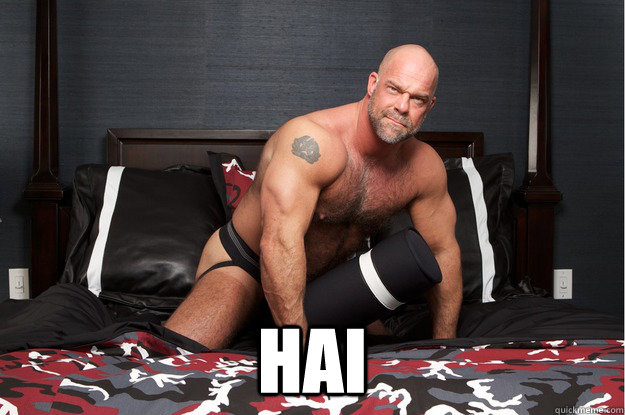
The image size is (625, 415). Identify the location of brown headboard. (245, 143).